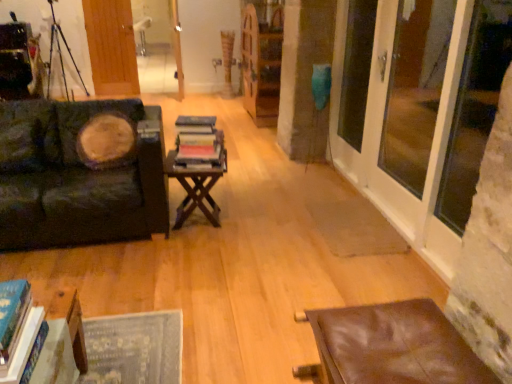
At what (x,y) coordinates should I click in order to perform the action: click on empty space that is to the right of velvet dark green couch at left. Please return your answer as a coordinate pair (x, y). The image size is (512, 384). Looking at the image, I should click on (234, 243).